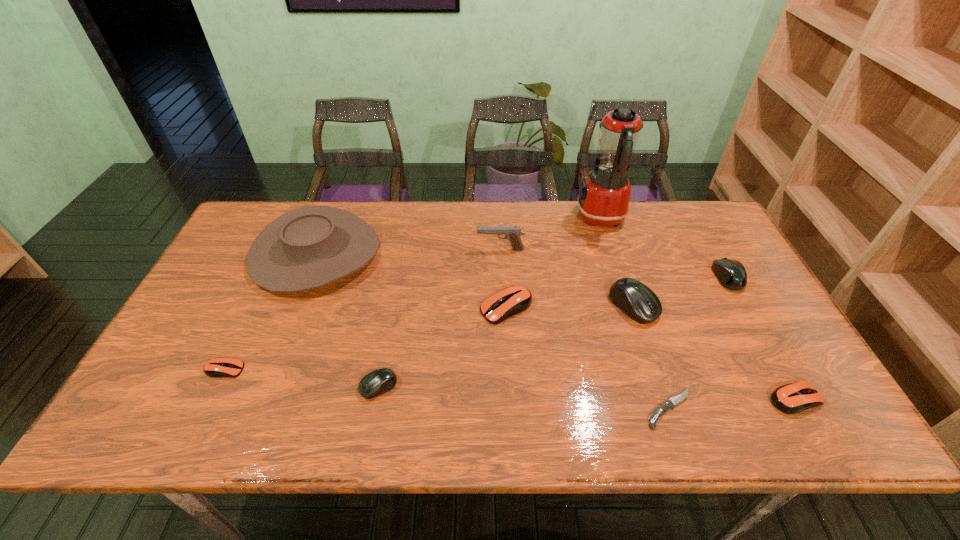
Where is `free space between the leftmost orange computer mouse and the shortest object`? This screenshot has width=960, height=540. free space between the leftmost orange computer mouse and the shortest object is located at coordinates (446, 389).

Where is `object that ranks as the sixth closest to the nearest orange computer mouse`? object that ranks as the sixth closest to the nearest orange computer mouse is located at coordinates (512, 233).

In order to click on the seventh closest object relative to the farthest orange computer mouse in this screenshot , I will do `click(731, 274)`.

This screenshot has height=540, width=960. In order to click on the fourth closest computer mouse to the second smallest black mouse in this screenshot , I will do `click(379, 381)`.

Identify the location of computer mouse that can be found as the closest to the farthest orange computer mouse. The height and width of the screenshot is (540, 960). (635, 299).

I want to click on black mouse that stands as the third closest to the second nearest orange computer mouse, so click(731, 274).

I want to click on the third closest black mouse to the cowboy hat, so click(731, 274).

Choose which orange computer mouse is the second nearest neighbor to the fifth shortest computer mouse. Please provide its 2D coordinates. Your answer should be formatted as a tuple, i.e. [(x, y)], where the tuple contains the x and y coordinates of a point satisfying the conditions above.

[(512, 300)]

Identify which orange computer mouse is located as the nearest to the tallest computer mouse. Please provide its 2D coordinates. Your answer should be formatted as a tuple, i.e. [(x, y)], where the tuple contains the x and y coordinates of a point satisfying the conditions above.

[(512, 300)]

The width and height of the screenshot is (960, 540). Find the location of `free spot that satisfies the following two spatial constraints: 1. at the barrel of the shortest object; 2. on the left side of the pistol`. free spot that satisfies the following two spatial constraints: 1. at the barrel of the shortest object; 2. on the left side of the pistol is located at coordinates (509, 409).